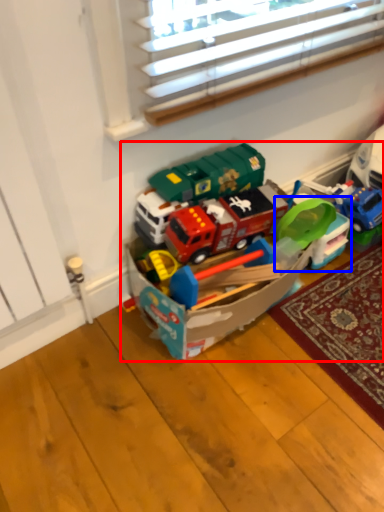
Question: Which of the following is the closest to the observer, toy (highlighted by a red box) or toy (highlighted by a blue box)?

Choices:
 (A) toy
 (B) toy

Answer: (A)